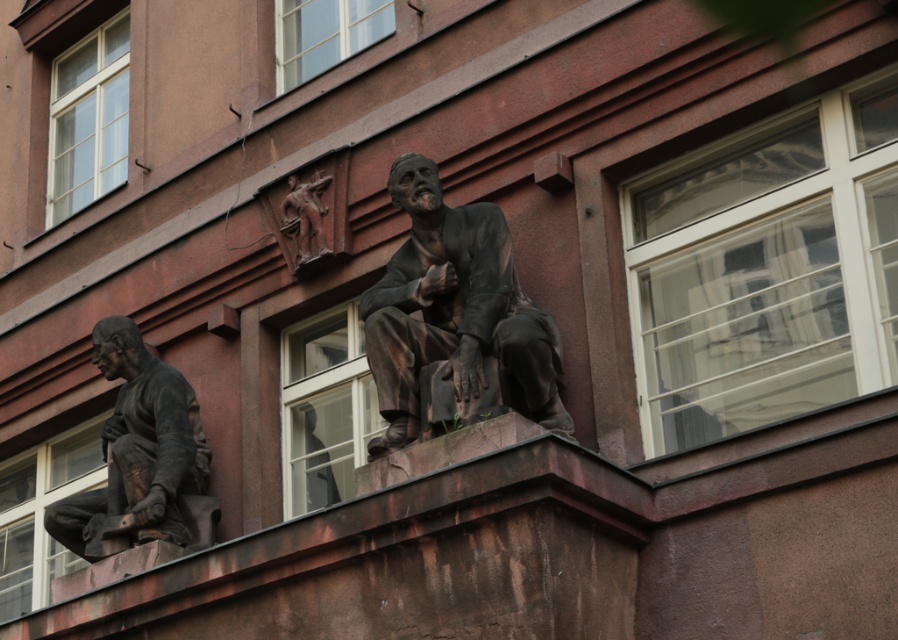
Question: Which of the following is the farthest from the observer?

Choices:
 (A) matte bronze statue at lower left
 (B) bronze statue at upper center

Answer: (A)

Question: Which object appears farthest from the camera in this image?

Choices:
 (A) matte bronze statue at lower left
 (B) bronze statue at upper center

Answer: (A)

Question: From the image, what is the correct spatial relationship of bronze statue at upper center in relation to matte bronze statue at lower left?

Choices:
 (A) below
 (B) above

Answer: (B)

Question: Does bronze statue at upper center appear on the right side of matte bronze statue at lower left?

Choices:
 (A) yes
 (B) no

Answer: (A)

Question: Can you confirm if bronze statue at upper center is wider than matte bronze statue at lower left?

Choices:
 (A) yes
 (B) no

Answer: (A)